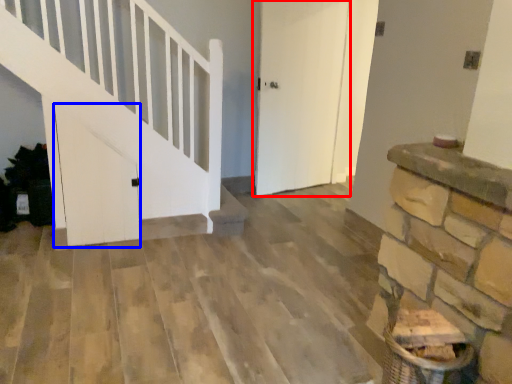
Question: Which of the following is the closest to the observer, door (highlighted by a red box) or door (highlighted by a blue box)?

Choices:
 (A) door
 (B) door

Answer: (B)